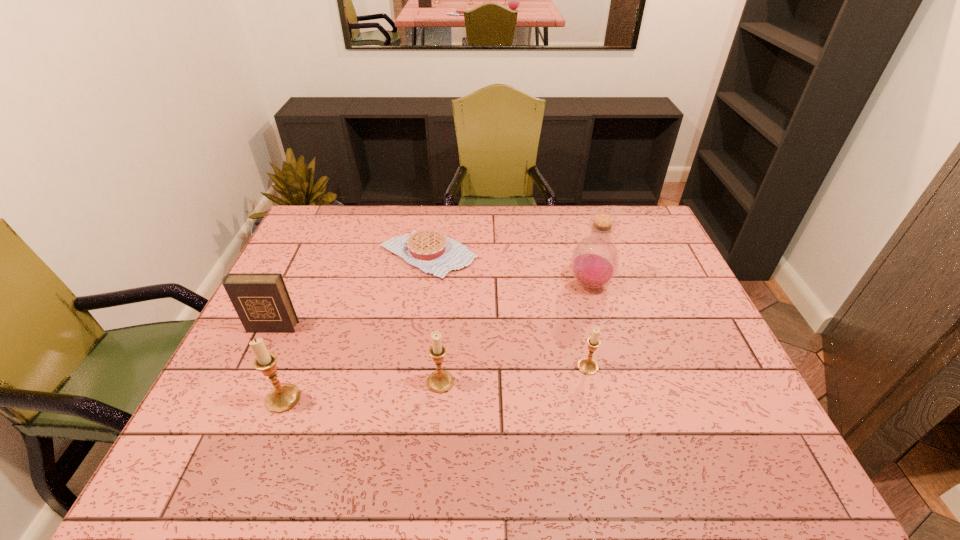
The height and width of the screenshot is (540, 960). In order to click on free space for a new candle holder on the right in this screenshot , I will do `click(726, 352)`.